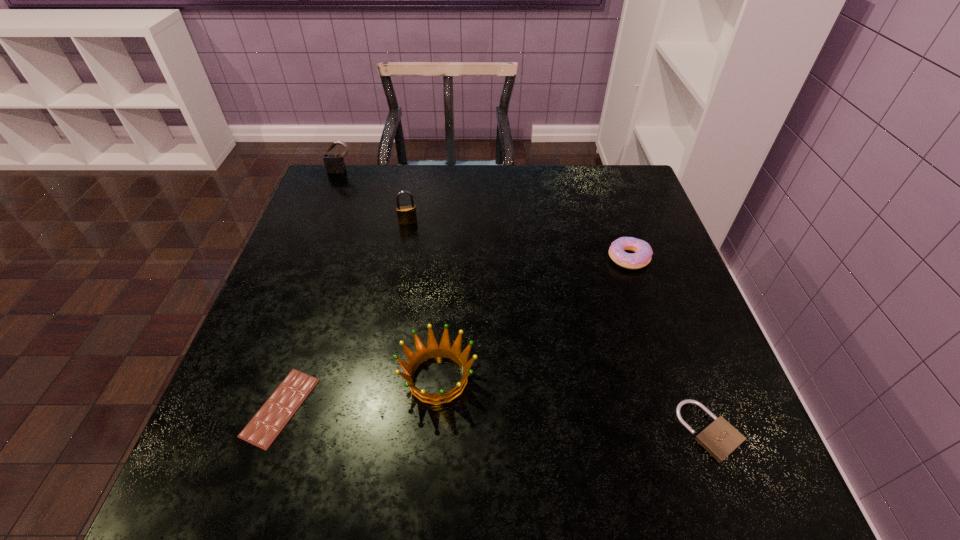
I want to click on free space at the far left corner, so click(352, 207).

The height and width of the screenshot is (540, 960). In order to click on free space at the far right corner in this screenshot , I will do `click(601, 170)`.

Image resolution: width=960 pixels, height=540 pixels. What are the coordinates of `vacant point located between the shortest object and the leftmost padlock` in the screenshot? It's located at (311, 289).

Find the location of a particular element. The image size is (960, 540). vacant region between the third object from left to right and the second shortest object is located at coordinates (559, 327).

Identify the location of free space between the farthest object and the shortest object. (311, 289).

The image size is (960, 540). I want to click on vacant area that lies between the fifth tallest object and the doughnut, so click(669, 345).

The height and width of the screenshot is (540, 960). I want to click on empty space that is in between the chocolate bar and the farthest padlock, so (x=311, y=289).

Identify the location of vacant area that lies between the third object from left to right and the leftmost padlock. [x=374, y=197].

The image size is (960, 540). Identify the location of unoccupied area between the nearest padlock and the farthest padlock. (525, 301).

Identify the location of free space between the fourth shortest object and the shortest object. Image resolution: width=960 pixels, height=540 pixels. (359, 393).